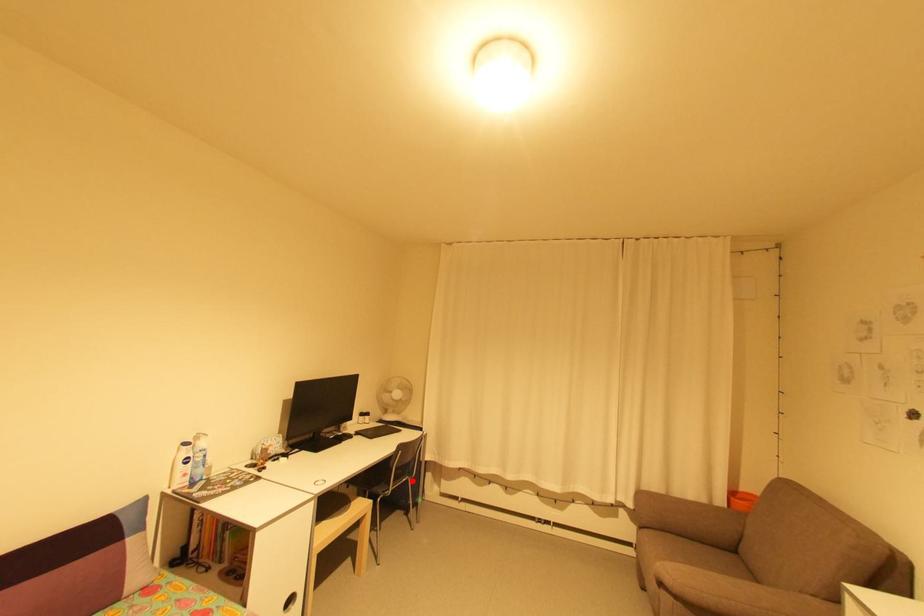
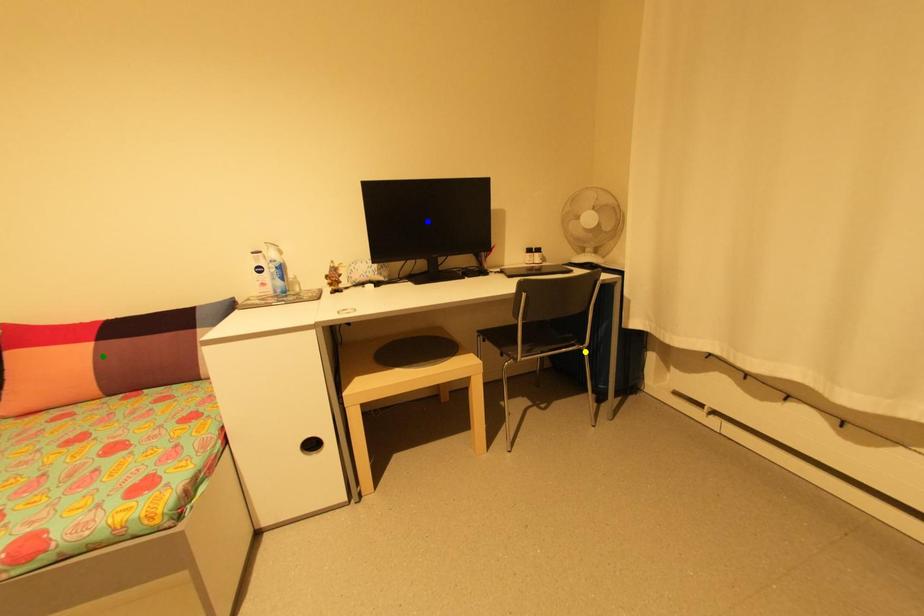
Question: I am providing you with two images of the same scene from different viewpoints. A red point is marked on the first image. You are given multiple points on the second image. Can you choose the point in image 2 that corresponds to the point in image 1?

Choices:
 (A) yellow point
 (B) green point
 (C) blue point

Answer: (A)